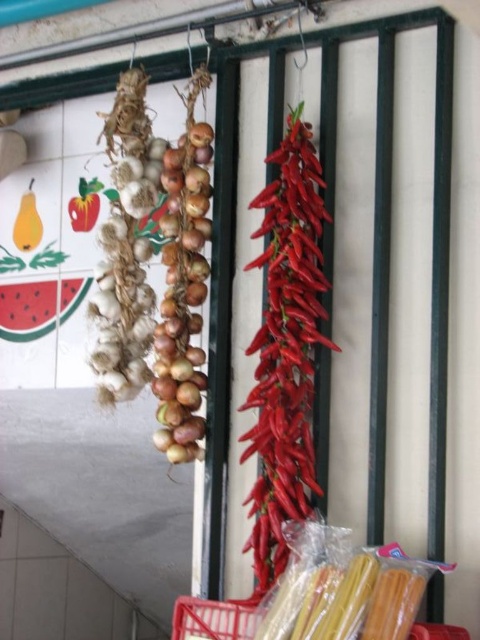
You are organizing a kitchen pantry and need to place the metallic red basket at lower center and the smooth red pepper at upper left on a shelf. Which object should you place first to ensure both fit properly?

The metallic red basket at lower center is shorter than the smooth red pepper at upper left, so you should place the smooth red pepper at upper left first to accommodate its height.